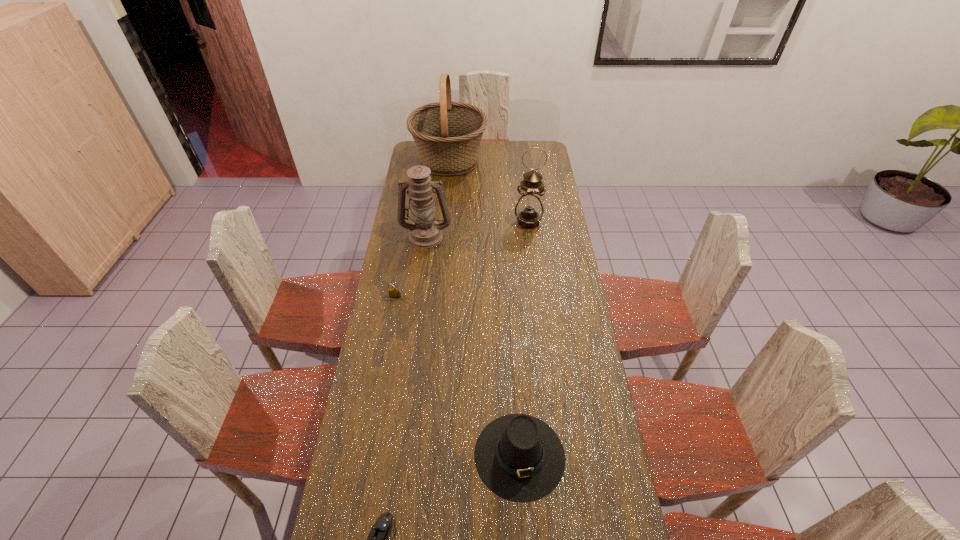
At what (x,y) coordinates should I click in order to perform the action: click on vacant space located on the side with the combination dials of the fifth tallest object. Please return your answer as a coordinate pair (x, y). This screenshot has height=540, width=960. Looking at the image, I should click on (386, 349).

Where is `object that is at the far edge`? The image size is (960, 540). object that is at the far edge is located at coordinates (447, 134).

Image resolution: width=960 pixels, height=540 pixels. What are the coordinates of `basket that is at the left edge` in the screenshot? It's located at (447, 134).

You are a GUI agent. You are given a task and a screenshot of the screen. Output one action in this format:
    pyautogui.click(x=<x>, y=<y>)
    Task: Click on the oil lamp that is positioned at the left edge
    The width and height of the screenshot is (960, 540).
    Given the screenshot: What is the action you would take?
    pyautogui.click(x=425, y=232)

Where is `padlock located in the left edge section of the desktop`? The image size is (960, 540). padlock located in the left edge section of the desktop is located at coordinates (394, 292).

Locate an element on the screen. oil lamp that is positioned at the right edge is located at coordinates (529, 210).

This screenshot has width=960, height=540. I want to click on hat present at the right edge, so click(518, 457).

Where is `object situated at the far left corner`? Image resolution: width=960 pixels, height=540 pixels. object situated at the far left corner is located at coordinates (447, 134).

I want to click on vacant area at the left edge, so click(x=407, y=255).

Locate an element on the screen. vacant area at the right edge is located at coordinates (562, 323).